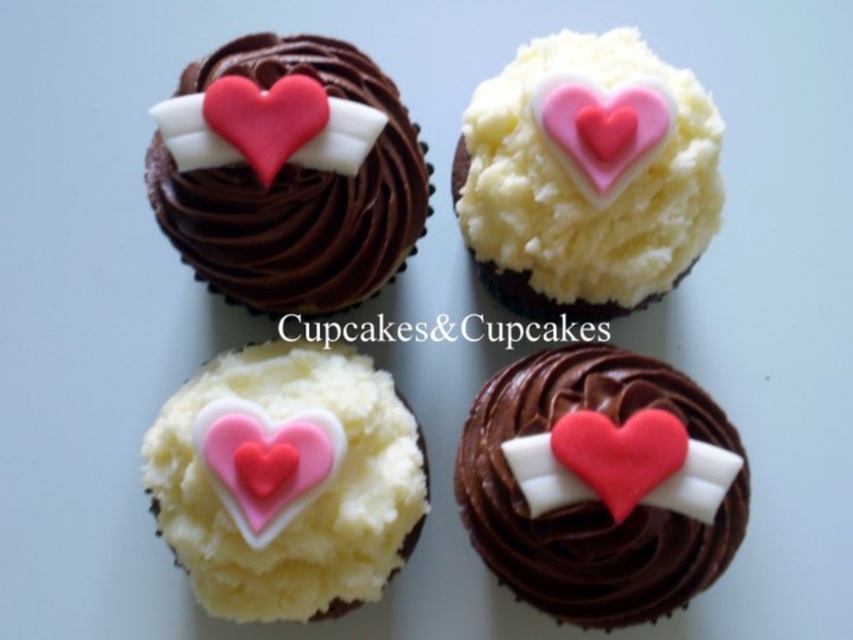
You are a baker trying to place the matte pink fondant heart at bottom right onto the white fluffy cupcake at upper right. Based on the size of the heart and the cupcake, will the heart fit on top of the cupcake without falling off?

The white fluffy cupcake at upper right is larger in size compared to the matte pink fondant heart at bottom right, so the heart should fit securely on top of the cupcake without falling off.

What is the relationship between the sizes of the pink fondant heart at upper center and the matte pink fondant heart at upper left?

The pink fondant heart at upper center is larger in width than the matte pink fondant heart at upper left.

You are a baker who wants to place both the pink fondant heart at upper center and the matte pink fondant heart at upper left onto a single cupcake without overlapping them. Which heart should you place higher up to ensure they don not overlap?

The pink fondant heart at upper center is taller than the matte pink fondant heart at upper left, so you should place the pink fondant heart at upper center higher up to prevent overlapping.